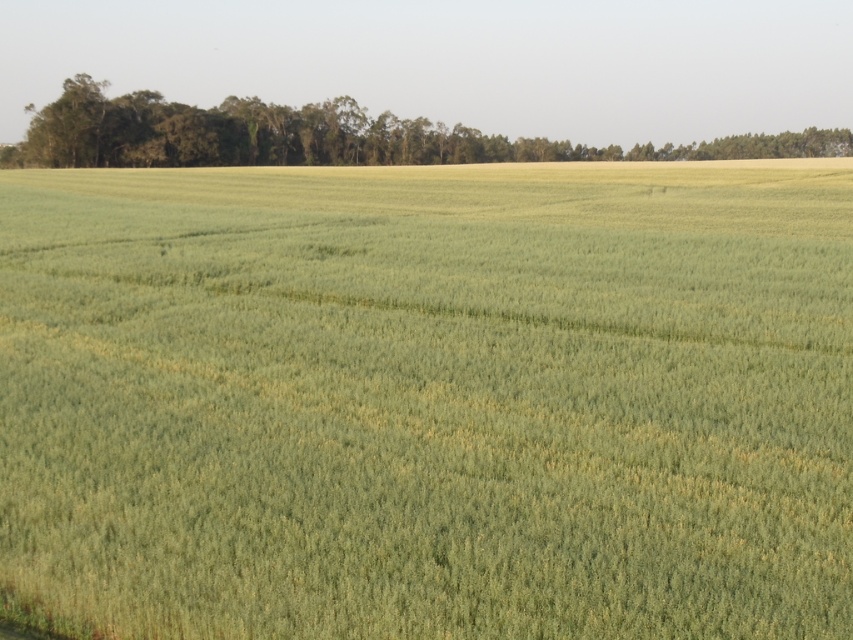
Which is in front, point (836, 595) or point (798, 132)?

Point (836, 595)

In the scene shown: Which is more to the right, green grass at center or green leafy trees at upper center?

green grass at center

Locate an element on the screen. Image resolution: width=853 pixels, height=640 pixels. green grass at center is located at coordinates (427, 401).